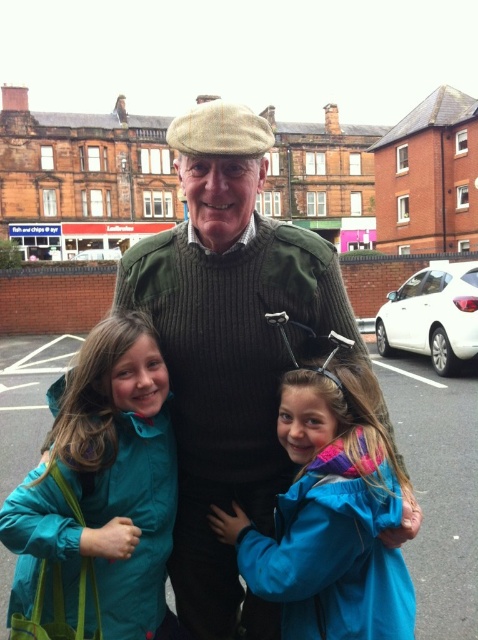
In the scene shown: You are a photographer trying to capture a candid shot of the two girls in the image. You want to ensure that both the green wool sweater at center and the blue fabric jacket at center are visible in the frame. Based on their positions, which one should you focus on first to include both in the shot?

The green wool sweater at center is to the left of the blue fabric jacket at center, so you should focus on the blue fabric jacket at center first to ensure both are in the frame.

You are a photographer trying to focus on the green wool sweater at center and the teal fabric jacket at lower left. Which item is closer to the camera?

The green wool sweater at center is positioned over the teal fabric jacket at lower left, meaning it is closer to the camera.